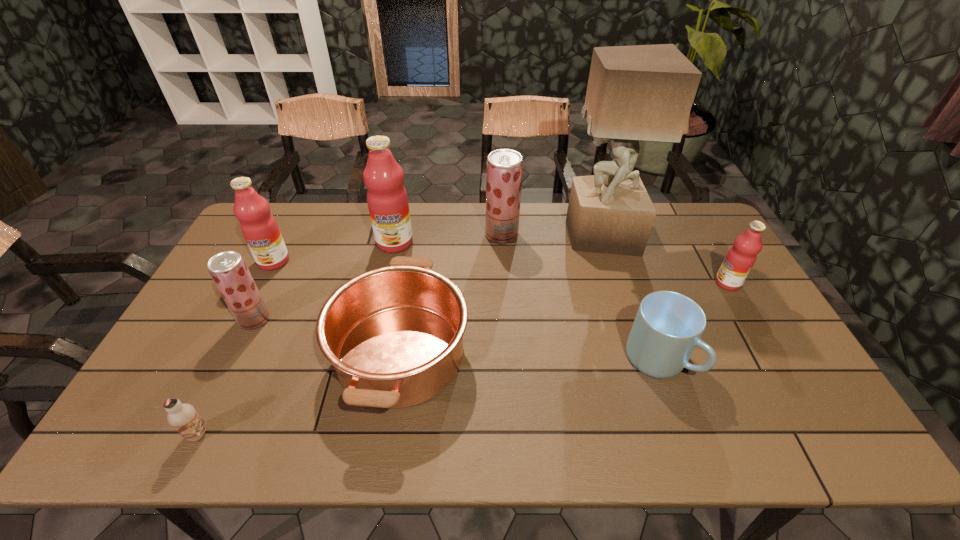
Locate an element on the screen. The image size is (960, 540). the smaller strawberry fruit juice is located at coordinates (228, 269).

The height and width of the screenshot is (540, 960). I want to click on mug, so click(668, 325).

Locate an element on the screen. Image resolution: width=960 pixels, height=540 pixels. saucepan is located at coordinates (394, 335).

Identify the location of chocolate milk. (183, 417).

Locate an element on the screen. vacant position located on the front-facing side of the tallest object is located at coordinates (519, 235).

I want to click on vacant area situated on the front-facing side of the tallest object, so click(x=468, y=235).

This screenshot has height=540, width=960. Identify the location of free space located 0.260m on the front-facing side of the tallest object. (491, 235).

You are a GUI agent. You are given a task and a screenshot of the screen. Output one action in this format:
    pyautogui.click(x=<x>, y=<y>)
    Task: Click on the vacant region located 0.150m on the label of the biggest pink fruit juice
    The height and width of the screenshot is (540, 960).
    Given the screenshot: What is the action you would take?
    pyautogui.click(x=385, y=287)

Image resolution: width=960 pixels, height=540 pixels. I want to click on free spot located on the front of the right strawberry fruit juice, so click(x=505, y=290).

This screenshot has height=540, width=960. I want to click on vacant space located 0.380m on the label of the second smallest pink fruit juice, so click(217, 374).